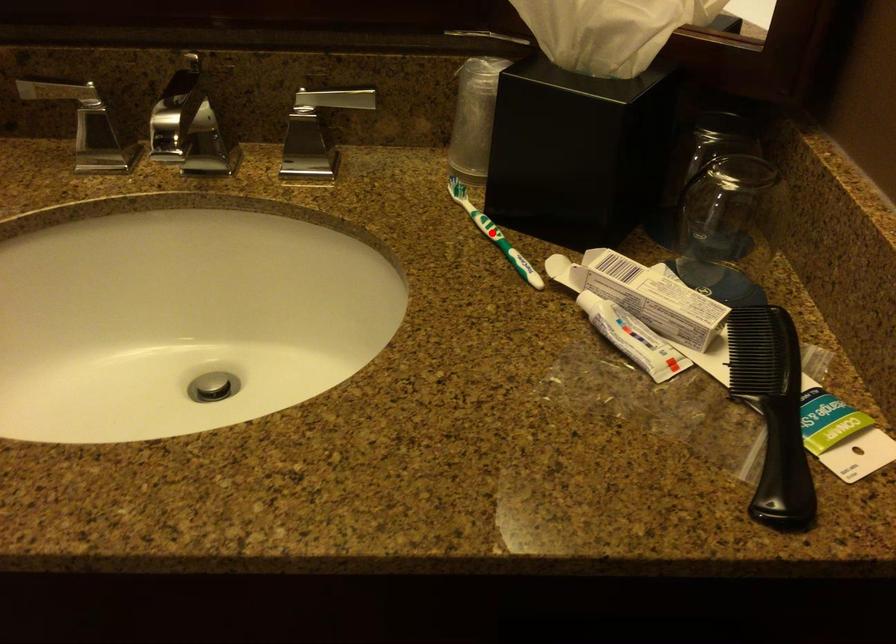
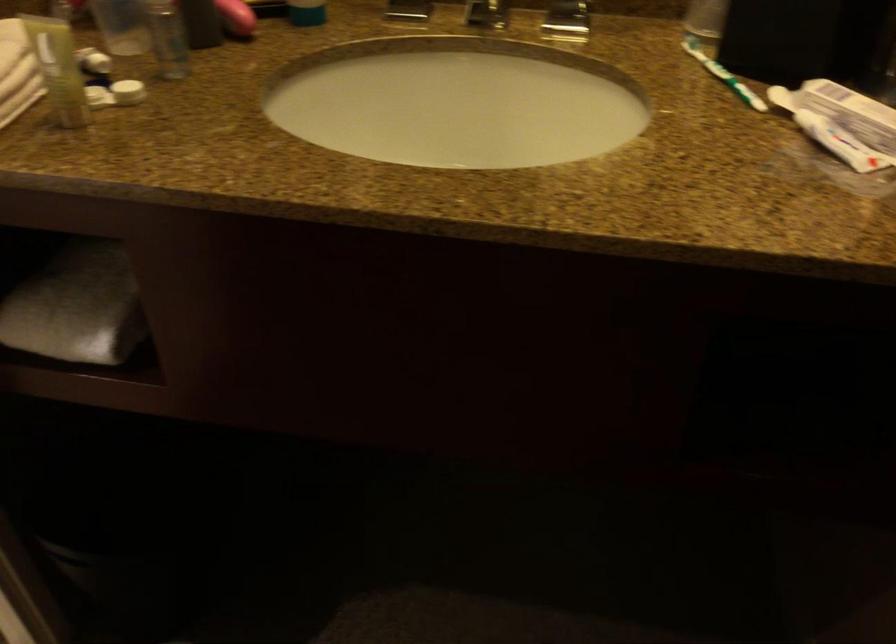
Question: I am providing you with two images of the same scene from different viewpoints. Given a red point in image1, look at the same physical point in image2. Is it:

Choices:
 (A) Closer to the viewpoint
 (B) Farther from the viewpoint

Answer: (B)